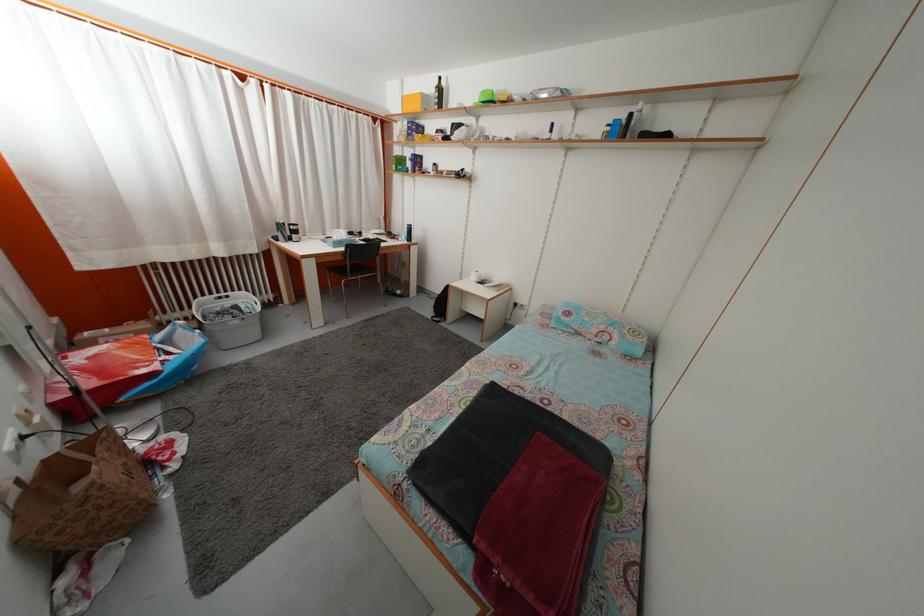
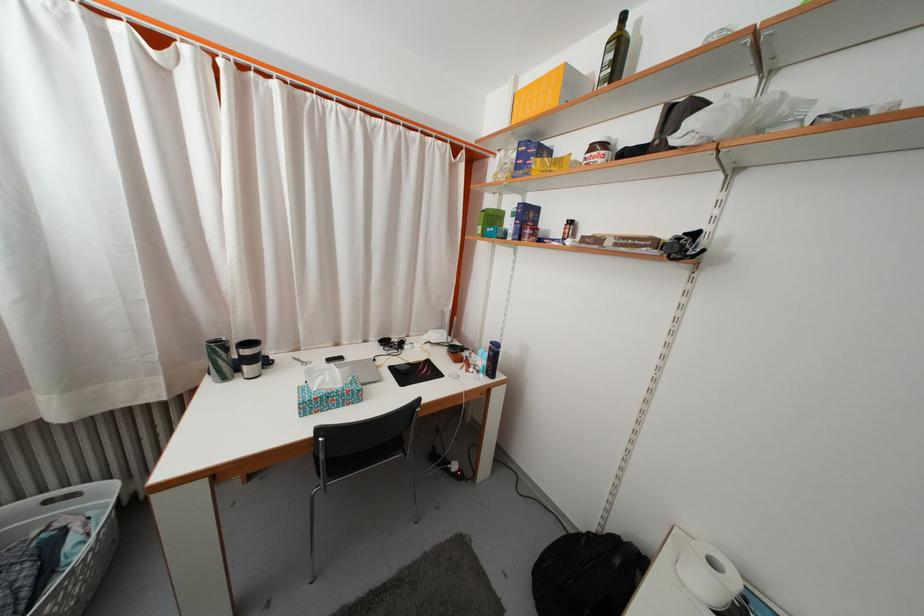
Find the pixel in the second image that matches (217,302) in the first image.

(49, 498)